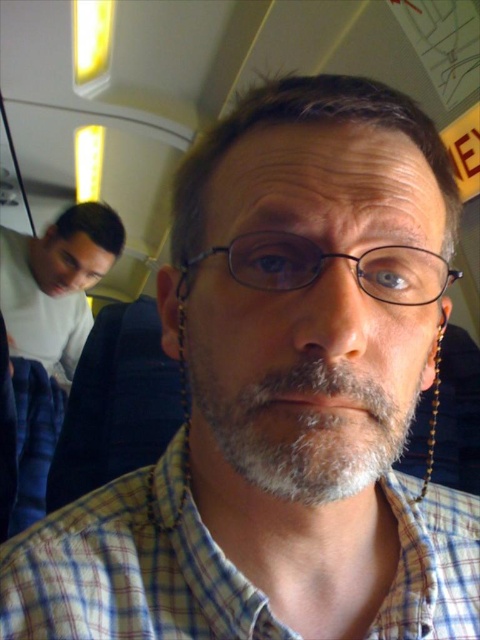
You are a photographer trying to capture a detailed shot of the man in the selfie. You notice two points in the image at coordinates point (x=409, y=586) and point (x=257, y=246). Which point is closer to you, the photographer?

Point (x=409, y=586) is further to the viewer than point (x=257, y=246), so the point closer to you is point (x=257, y=246).

The man in the image is wearing a plaid cotton shirt at center and black plastic glasses at center. Which item is located higher on his body?

The black plastic glasses at center are located higher on the man than the plaid cotton shirt at center because the glasses are positioned above the shirt.

You are a photographer trying to focus on the man in the plaid shirt. The camera you are using has a focus point at coordinate point (126, 577). Based on the image description, will this focus point successfully capture the plaid cotton shirt at center?

Yes, the focus point at coordinate point (126, 577) marks the plaid cotton shirt at center, so it will successfully capture the plaid cotton shirt at center.